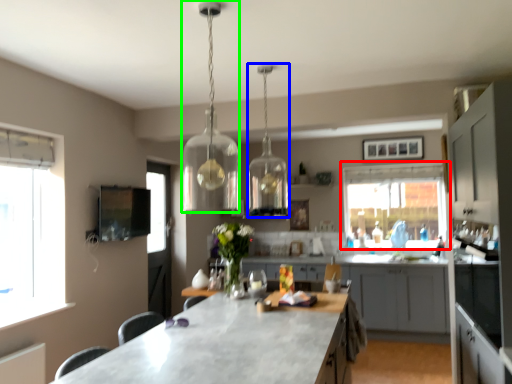
Question: Based on their relative distances, which object is nearer to window (highlighted by a red box)? Choose from lamp (highlighted by a blue box) and lamp (highlighted by a green box).

Choices:
 (A) lamp
 (B) lamp

Answer: (A)